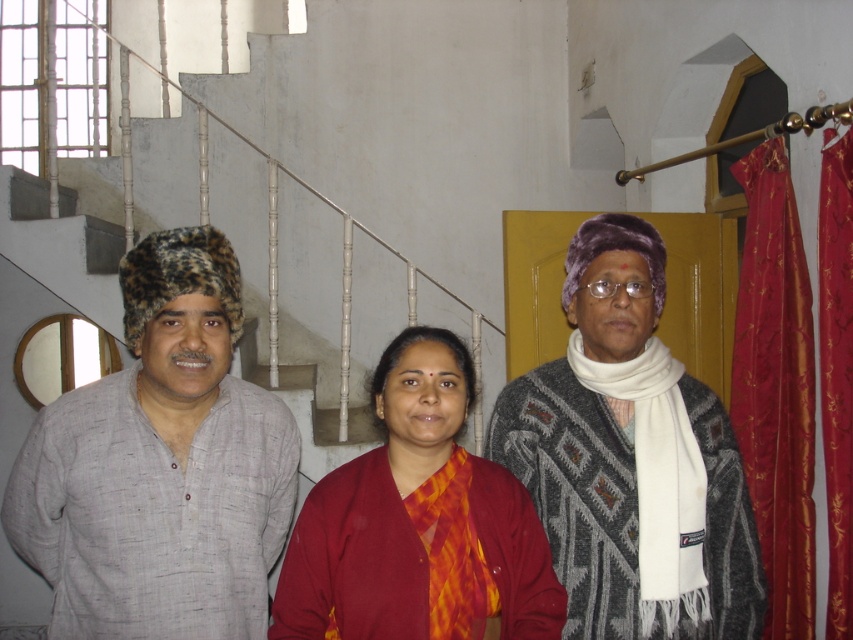
Question: Does knitted woolen sweater at center have a lesser width compared to red silk saree at center?

Choices:
 (A) no
 (B) yes

Answer: (A)

Question: Which of these objects is positioned farthest from the white textured stairs at upper left?

Choices:
 (A) light gray cotton kurta at left
 (B) shiny red fabric at right
 (C) red silk saree at center

Answer: (C)

Question: Does light gray cotton kurta at left have a smaller size compared to red satin curtain at right?

Choices:
 (A) no
 (B) yes

Answer: (A)

Question: Is white textured stairs at upper left wider than red satin curtain at right?

Choices:
 (A) no
 (B) yes

Answer: (B)

Question: Which point is farther to the camera?

Choices:
 (A) white textured stairs at upper left
 (B) red silk saree at center
 (C) red satin curtain at right

Answer: (A)

Question: Which of the following is the closest to the observer?

Choices:
 (A) (802, 544)
 (B) (535, 602)

Answer: (B)